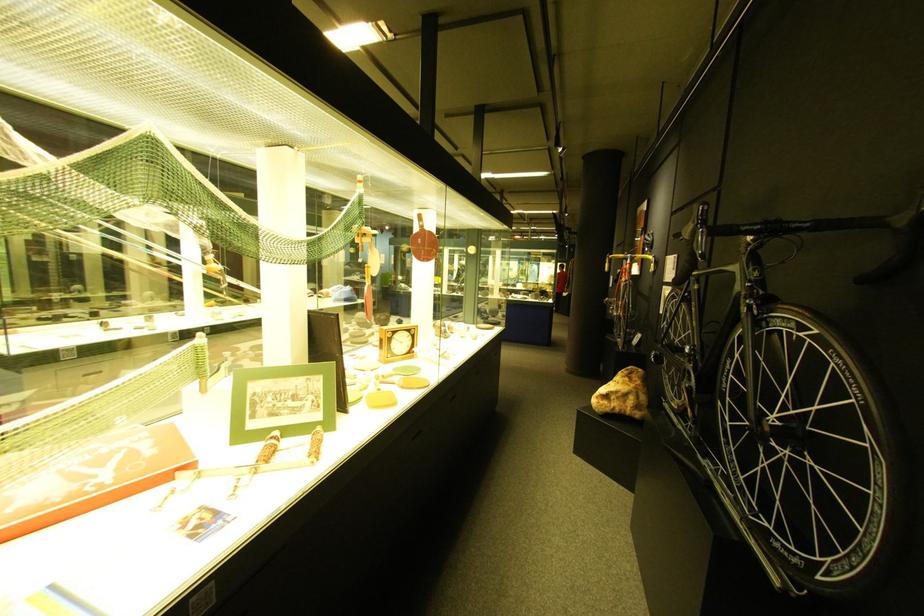
The width and height of the screenshot is (924, 616). In order to click on bicycle brake lever in this screenshot , I will do `click(647, 262)`.